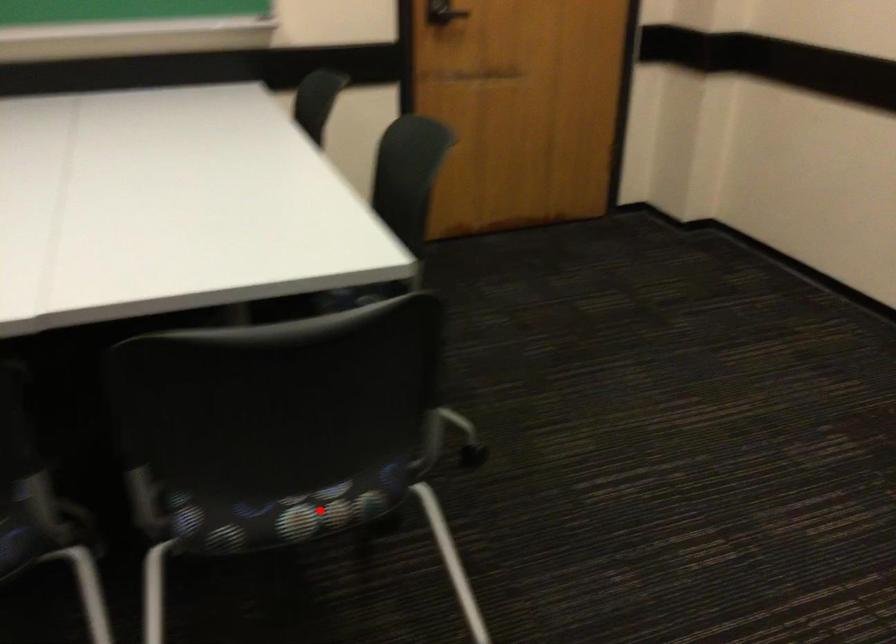
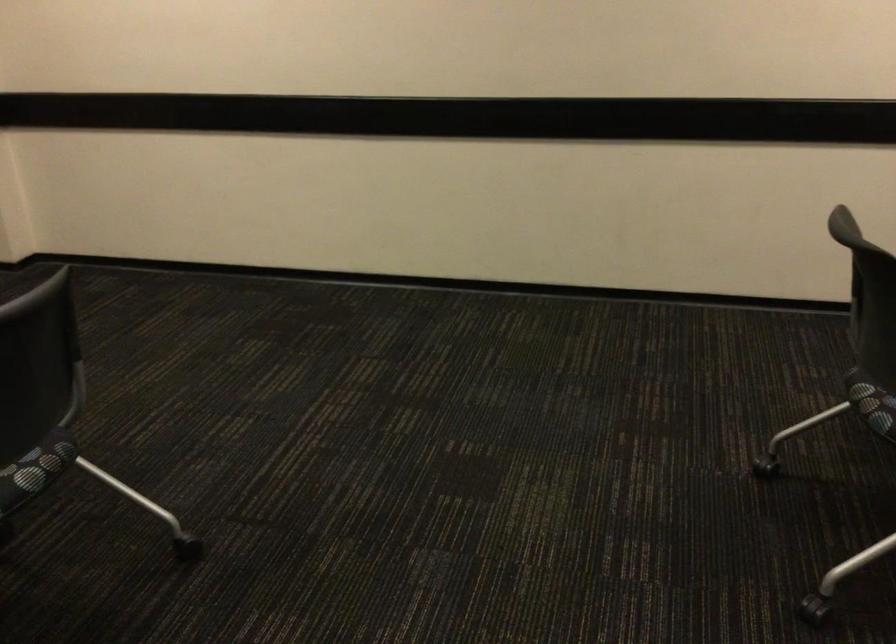
Locate, in the second image, the point that corresponds to the highlighted location in the first image.

(40, 462)